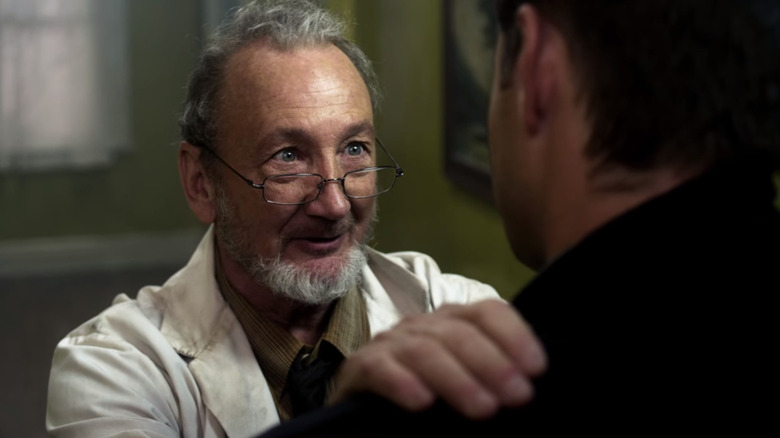
Identify the location of window. point(61,71).